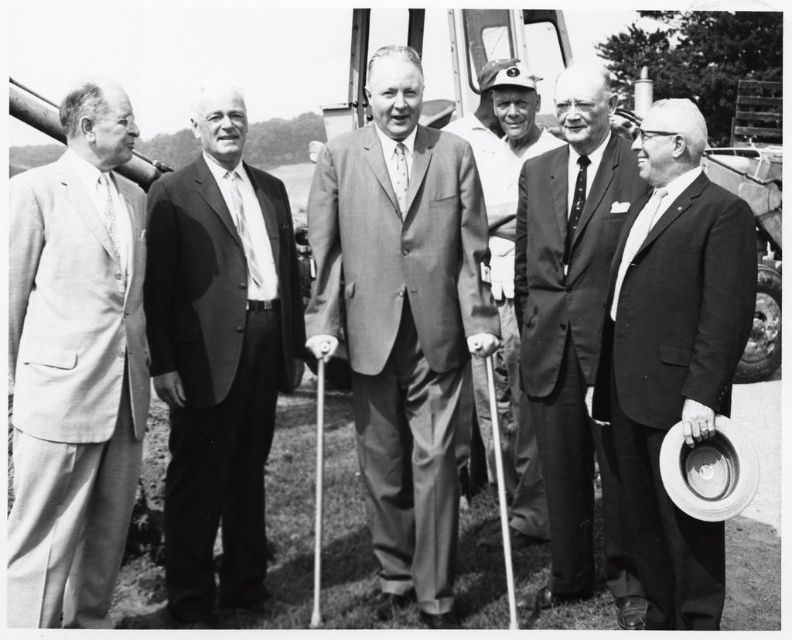
Is point (14, 205) in front of point (490, 60)?

Yes, point (14, 205) is in front of point (490, 60).

Does point (99, 356) come closer to viewer compared to point (489, 104)?

Yes, point (99, 356) is closer to viewer.

Identify the location of light gray suit at left. The height and width of the screenshot is (640, 792). (74, 369).

Can you confirm if smooth gray suit at center is shorter than white silk tie at center?

No, smooth gray suit at center is not shorter than white silk tie at center.

Who is taller, smooth gray suit at center or white silk tie at center?

smooth gray suit at center

I want to click on smooth gray suit at center, so click(402, 321).

Is smooth gray suit at center shorter than smooth white shirt at center?

Yes, smooth gray suit at center is shorter than smooth white shirt at center.

Can you confirm if smooth gray suit at center is wider than smooth white shirt at center?

Yes, smooth gray suit at center is wider than smooth white shirt at center.

Find the location of a particular element. smooth gray suit at center is located at coordinates (402, 321).

Where is `smooth gray suit at center`? smooth gray suit at center is located at coordinates (402, 321).